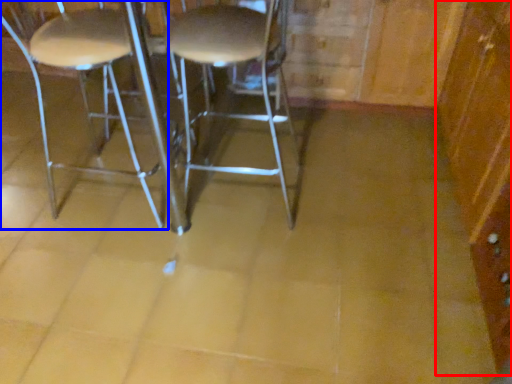
Question: Among these objects, which one is farthest to the camera, dresser (highlighted by a red box) or chair (highlighted by a blue box)?

Choices:
 (A) dresser
 (B) chair

Answer: (B)